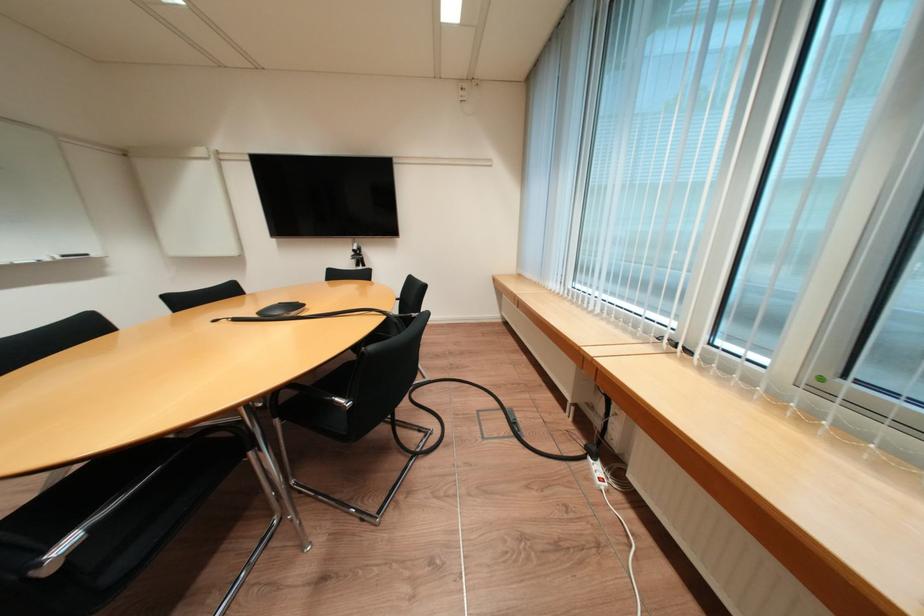
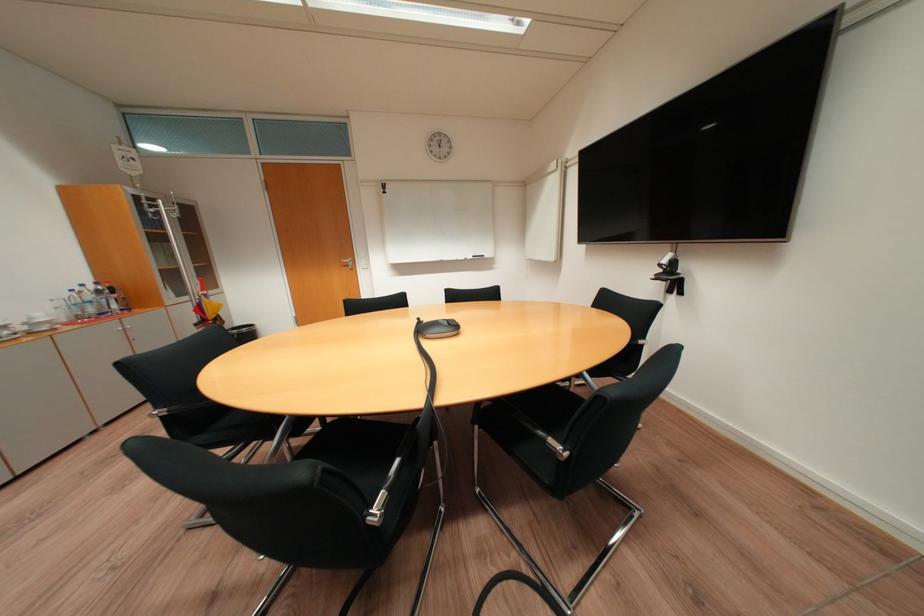
Question: I am providing you with two images of the same scene from different viewpoints. Which of the following objects are not visible in image2?

Choices:
 (A) black chair sitting surface
 (B) silver door handle
 (C) metallic chair armrest
 (D) blue and gray backpack

Answer: (A)